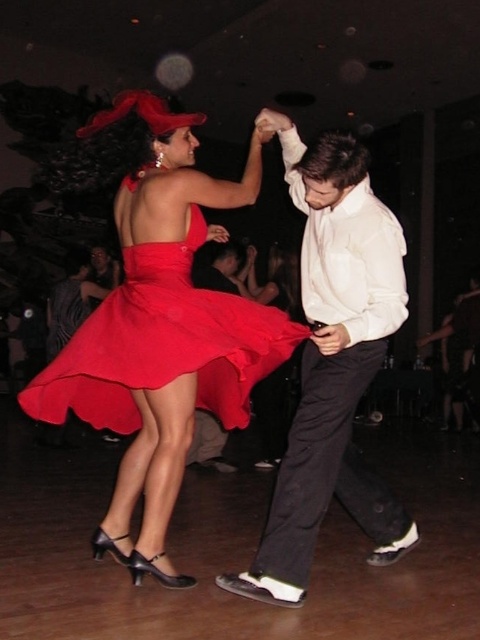
You are a photographer at the event and want to capture both the matte red dress at center and the matte satin dress at center in a single frame. Since you can adjust the camera angle, which dress should you position closer to the camera to ensure both are fully visible?

The matte red dress at center is much taller than the matte satin dress at center. To ensure both are fully visible in the frame, position the taller matte red dress at center closer to the camera. This way, the height difference will be minimized, allowing both dresses to fit within the camera view.

You are a photographer at the dance event and want to ensure both the white smooth shirt at center and the matte satin dress at center are visible in your photo. Given their positions, which one might you need to adjust the camera angle to capture fully?

The white smooth shirt at center has a greater height compared to the matte satin dress at center. Therefore, you might need to adjust the camera angle to capture the taller white smooth shirt at center fully, ensuring it doesn t get cut off in the frame.